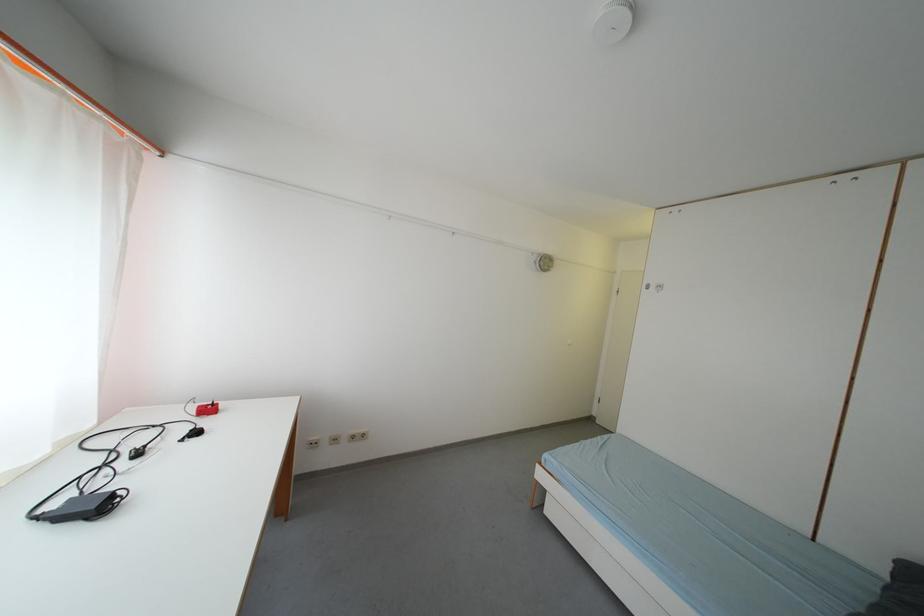
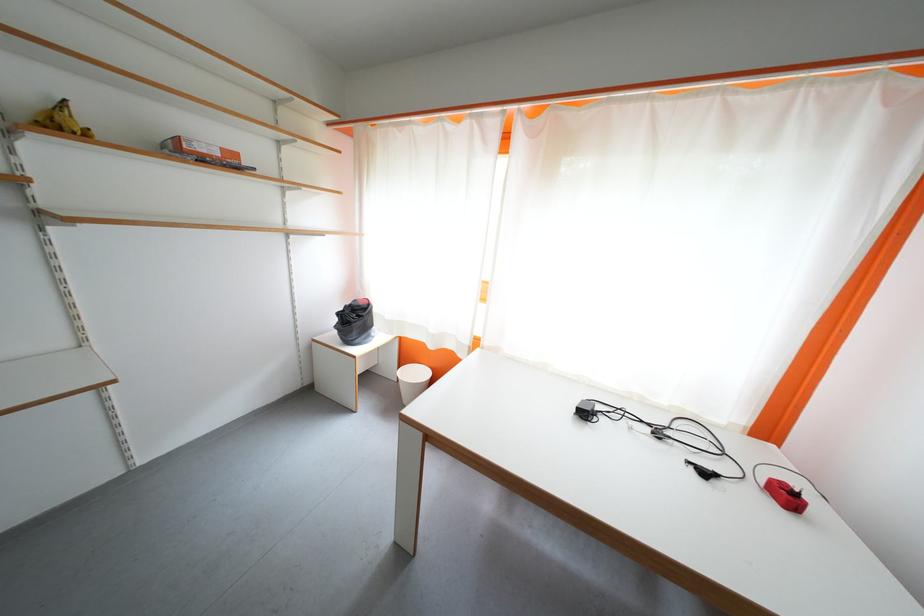
Find the pixel in the second image that matches pixel 217 413 in the first image.

(796, 500)